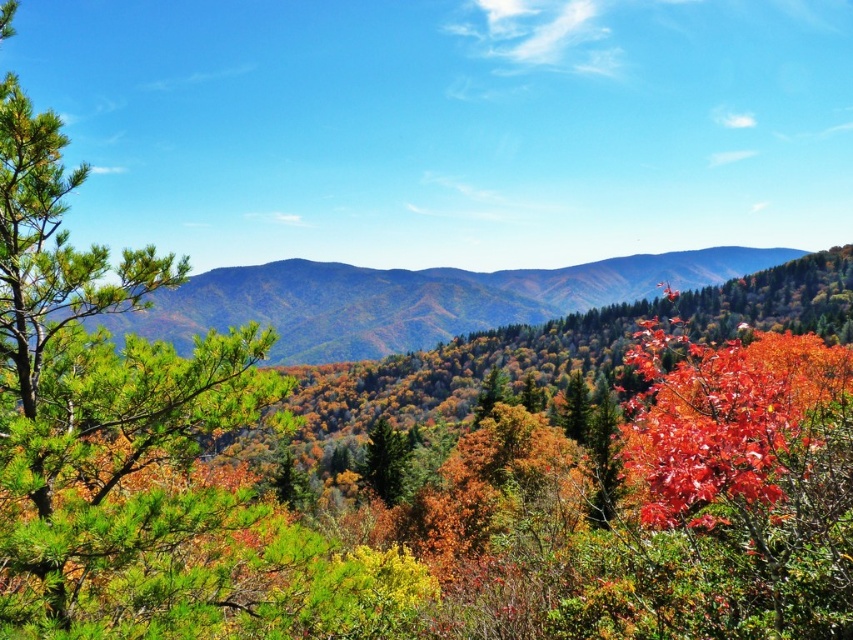
You are standing in the autumn landscape and want to take a photo of both the green matte forest at center and the green matte tree at center. Which object should you frame first in your camera to ensure both are in the shot?

The green matte forest at center is positioned on the right side of green matte tree at center, so you should frame the green matte tree at center first on the left and then include the green matte forest at center on its right to capture both in the shot.

You are standing at the point marked by point (412, 300) in the image. What do you see directly in front of you?

You see green matte forest at center directly in front of you.